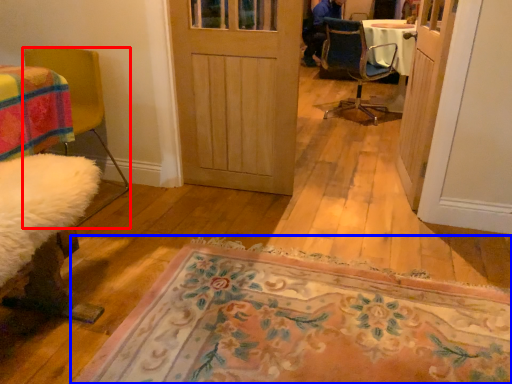
Question: Which object is closer to the camera taking this photo, chair (highlighted by a red box) or mat (highlighted by a blue box)?

Choices:
 (A) chair
 (B) mat

Answer: (B)